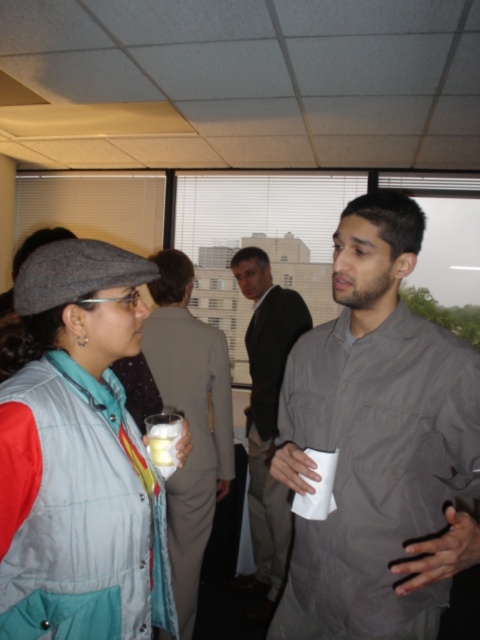
You are a photographer setting up a camera to take a group photo of the matte gray suit at center and the dark gray shirt at center. The camera has a minimum focus distance of 22 inches. Will both subjects be in focus if you position the camera at this distance?

The matte gray suit at center and dark gray shirt at center are 21.95 inches apart, which is slightly less than the camera minimum focus distance of 22 inches. Therefore, the subjects might not both be in focus at this distance.

You are organizing a charity event and need to arrange shirts based on their sizes. If you have a gray matte shirt at right and a dark gray shirt at center, which shirt should you place in the small size section?

The gray matte shirt at right should be placed in the small size section because it has a smaller size compared to the dark gray shirt at center.